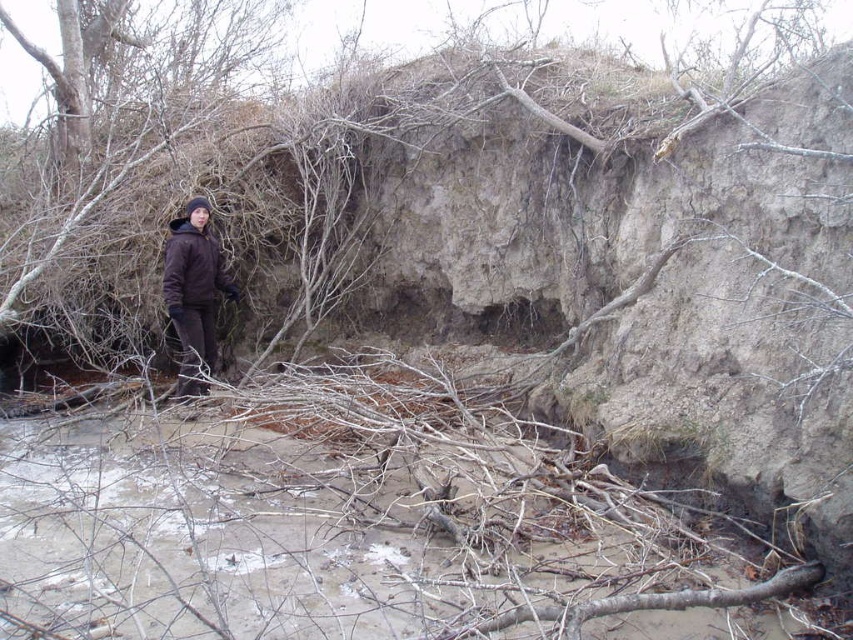
You see two jackets, a brown soft jacket at left and a brown matte jacket at left. Which one is more to the left?

The brown soft jacket at left is more to the left.

You are a geologist examining the eroded bank and need to place a marker at the exact center of the image. Where should you place it relative to the brown soft jacket at left?

The brown soft jacket at left is located at point (193, 291), so the exact center of the image would be at point (426, 320). To place the marker at the center, move it approximately 0.045 units to the right and 0.273 units upward from the brown soft jacket at left.

In the scene shown: You are a park ranger assessing the erosion site. You see the brown soft jacket at left lying near the steep bank. If you want to retrieve it without getting too close to the unstable bank, can you estimate whether you can reach it from your current position 10 meters away from the bank?

The brown soft jacket at left is only 5.87 meters away from the camera, so if you are 10 meters away from the bank, you are farther than the jacket. Therefore, you cannot reach it without moving closer to the bank.